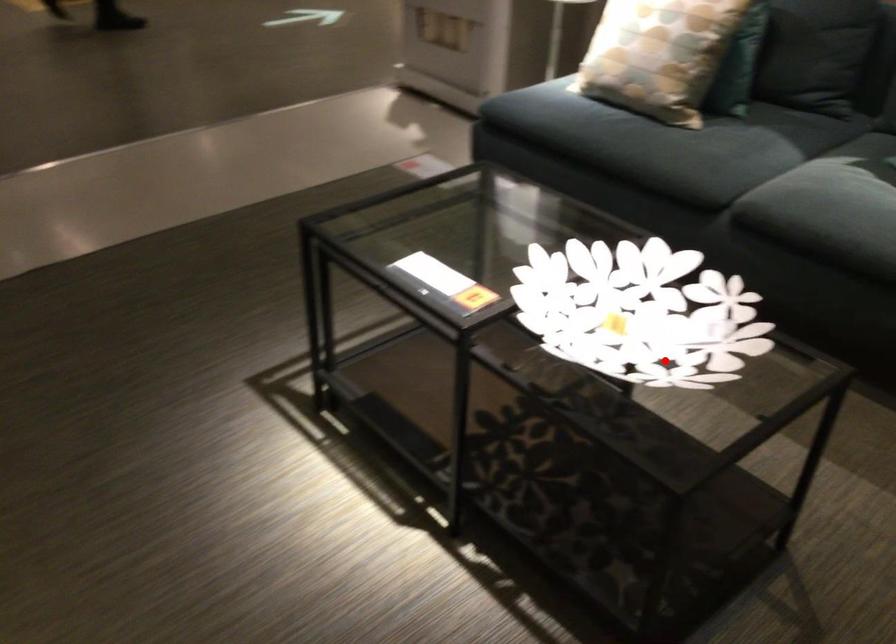
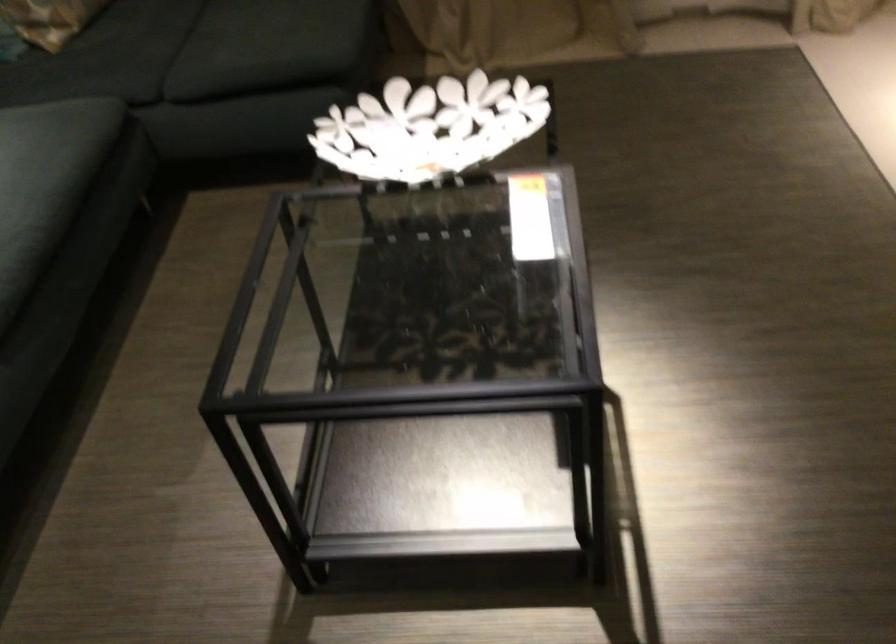
Find the pixel in the second image that matches the highlighted location in the first image.

(429, 127)